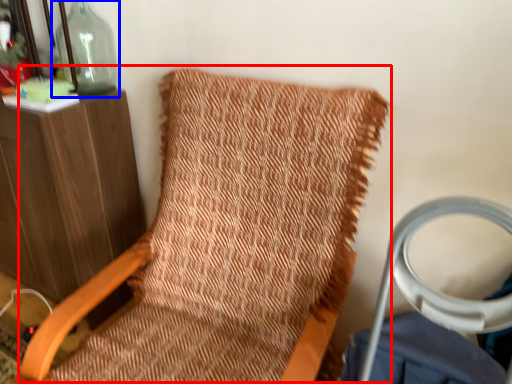
Question: Which object appears closest to the camera in this image, bean bag chair (highlighted by a red box) or bottle (highlighted by a blue box)?

Choices:
 (A) bean bag chair
 (B) bottle

Answer: (A)